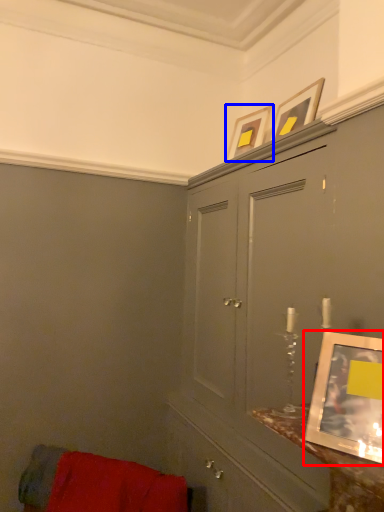
Question: Which object appears closest to the camera in this image, picture frame (highlighted by a red box) or picture frame (highlighted by a blue box)?

Choices:
 (A) picture frame
 (B) picture frame

Answer: (A)